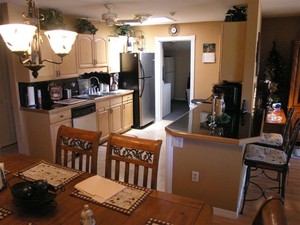
I want to click on counter tops, so click(181, 128), click(123, 92).